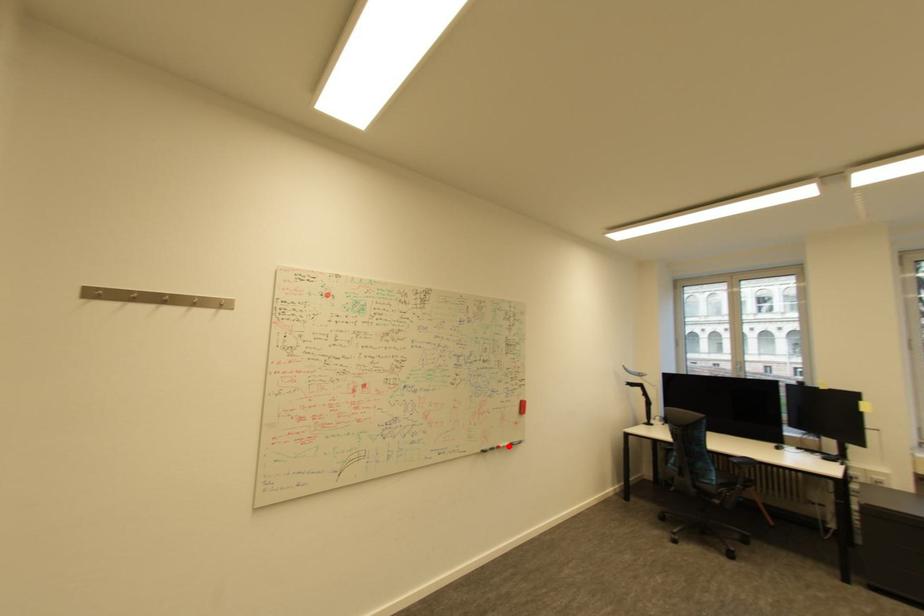
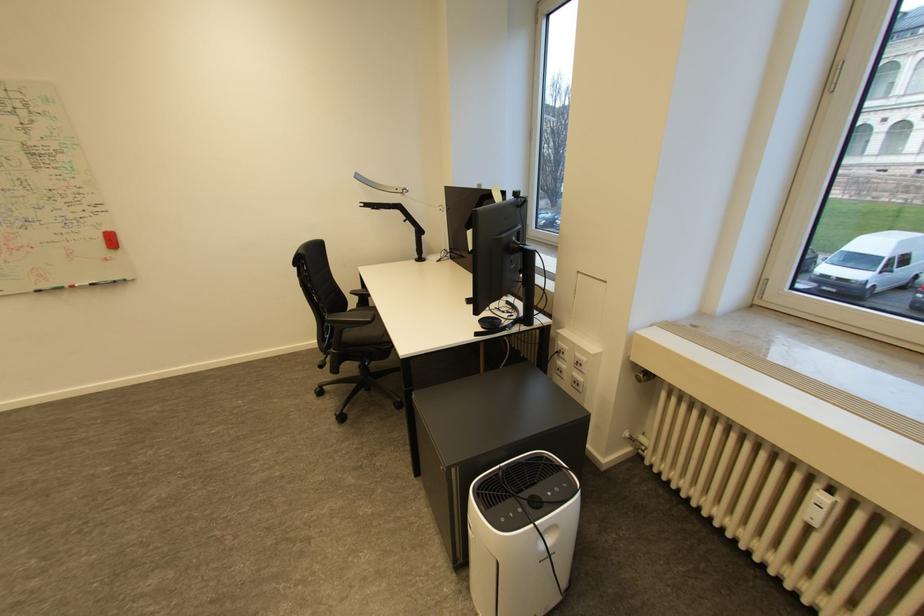
In the second image, find the point that corresponds to the highlighted location in the first image.

(83, 286)